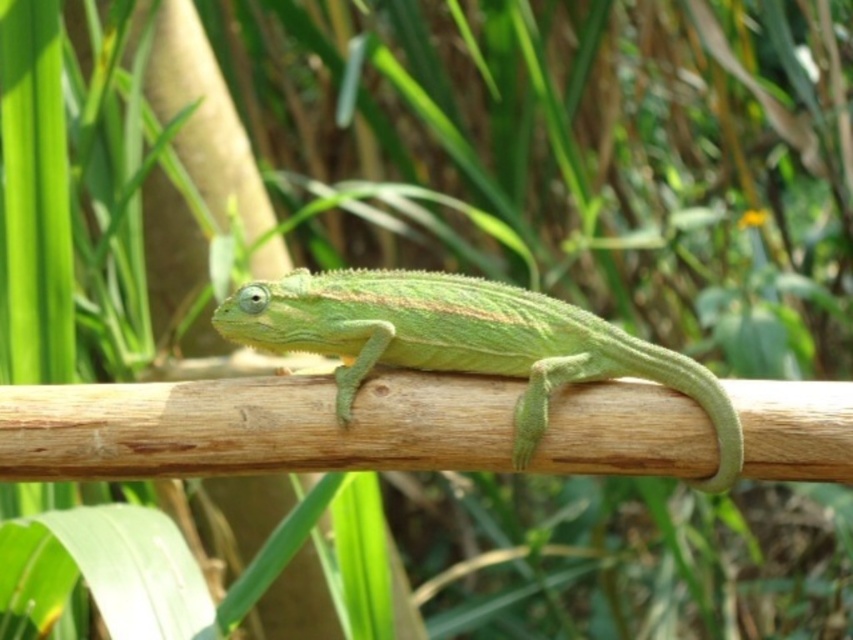
Question: Observing the image, what is the correct spatial positioning of smooth wood branch at center in reference to green matte lizard at center?

Choices:
 (A) right
 (B) left

Answer: (B)

Question: Is smooth wood branch at center thinner than green matte lizard at center?

Choices:
 (A) no
 (B) yes

Answer: (A)

Question: Which point is farther to the camera?

Choices:
 (A) smooth wood branch at center
 (B) green matte lizard at center

Answer: (B)

Question: Is smooth wood branch at center behind green matte lizard at center?

Choices:
 (A) no
 (B) yes

Answer: (A)